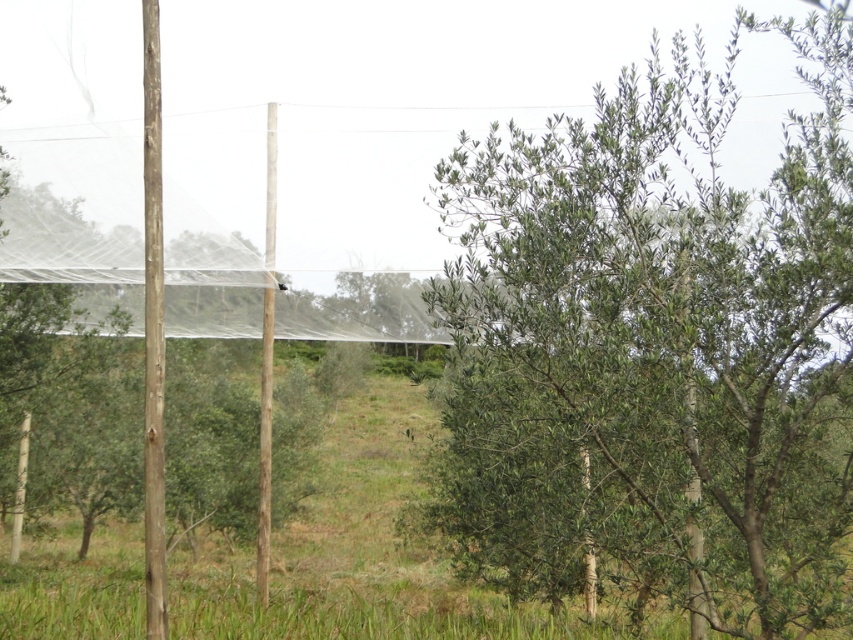
Question: Among these points, which one is farthest from the camera?

Choices:
 (A) (543, 138)
 (B) (144, 592)
 (C) (270, 176)

Answer: (C)

Question: Is brown rough wooden pole at left above brown wood pole at center?

Choices:
 (A) yes
 (B) no

Answer: (A)

Question: Which of these objects is positioned closest to the brown wood pole at center?

Choices:
 (A) brown rough wooden pole at left
 (B) green leafy tree at center

Answer: (A)

Question: Does green leafy tree at center have a greater width compared to brown rough wooden pole at left?

Choices:
 (A) yes
 (B) no

Answer: (A)

Question: Can you confirm if green leafy tree at center is thinner than brown rough wooden pole at left?

Choices:
 (A) no
 (B) yes

Answer: (A)

Question: Which point is closer to the camera taking this photo?

Choices:
 (A) (474, 145)
 (B) (264, 496)

Answer: (A)